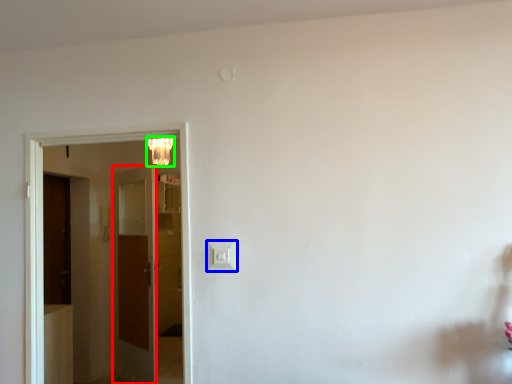
Question: Considering the real-world distances, which object is closest to door (highlighted by a red box)? light switch (highlighted by a blue box) or lamp (highlighted by a green box).

Choices:
 (A) light switch
 (B) lamp

Answer: (B)